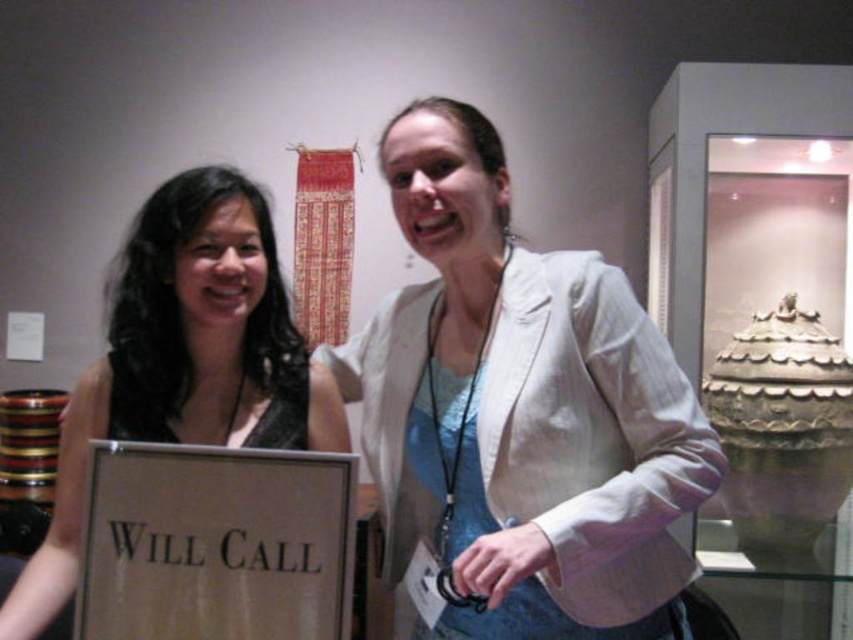
Question: Which point is closer to the camera?

Choices:
 (A) black satin dress at left
 (B) white textured blazer at center

Answer: (B)

Question: Is white textured blazer at center to the right of black satin dress at left from the viewer's perspective?

Choices:
 (A) yes
 (B) no

Answer: (A)

Question: Observing the image, what is the correct spatial positioning of white textured blazer at center in reference to black satin dress at left?

Choices:
 (A) right
 (B) left

Answer: (A)

Question: Among these objects, which one is farthest from the camera?

Choices:
 (A) white textured blazer at center
 (B) black satin dress at left

Answer: (B)

Question: Which point is closer to the camera?

Choices:
 (A) white textured blazer at center
 (B) black satin dress at left

Answer: (A)

Question: Is white textured blazer at center above black satin dress at left?

Choices:
 (A) yes
 (B) no

Answer: (A)